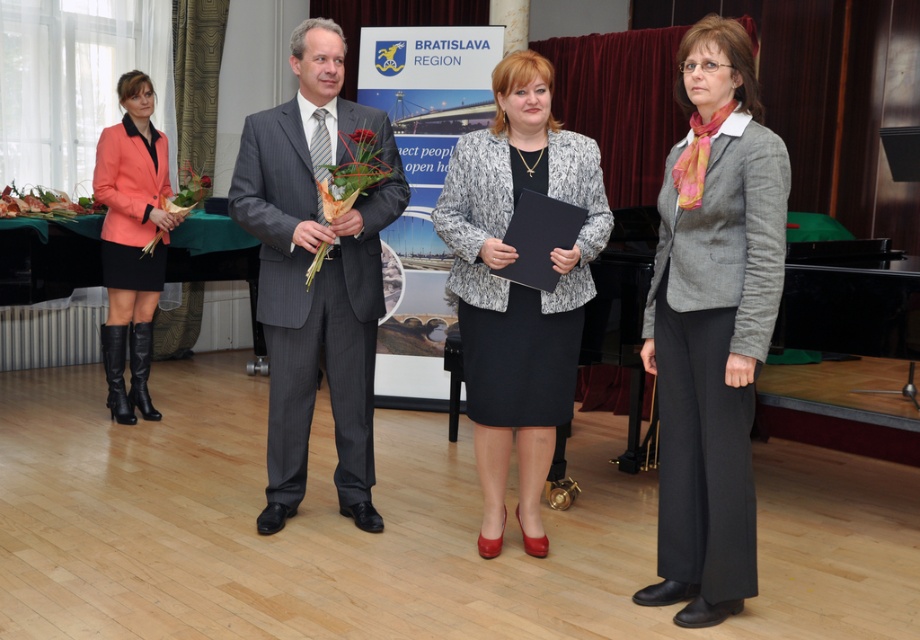
Which of these two, gray pinstripe suit at center or green leafy bouquet at center, stands taller?

With more height is gray pinstripe suit at center.

Find the location of a particular element. The width and height of the screenshot is (920, 640). gray pinstripe suit at center is located at coordinates (315, 275).

Is point (739, 291) closer to camera compared to point (525, 337)?

Yes, point (739, 291) is closer to viewer.

Is gray woolen blazer at center bigger than speckled woolen blazer at center?

Yes.

Between point (740, 184) and point (477, 461), which one is positioned behind?

Point (477, 461)

Locate an element on the screen. gray woolen blazer at center is located at coordinates (713, 323).

Is matte orange blazer at left taller than matte green bouquet at center?

Yes.

Does matte orange blazer at left have a smaller size compared to matte green bouquet at center?

Actually, matte orange blazer at left might be larger than matte green bouquet at center.

This screenshot has width=920, height=640. What do you see at coordinates (131, 241) in the screenshot?
I see `matte orange blazer at left` at bounding box center [131, 241].

Image resolution: width=920 pixels, height=640 pixels. I want to click on matte orange blazer at left, so click(x=131, y=241).